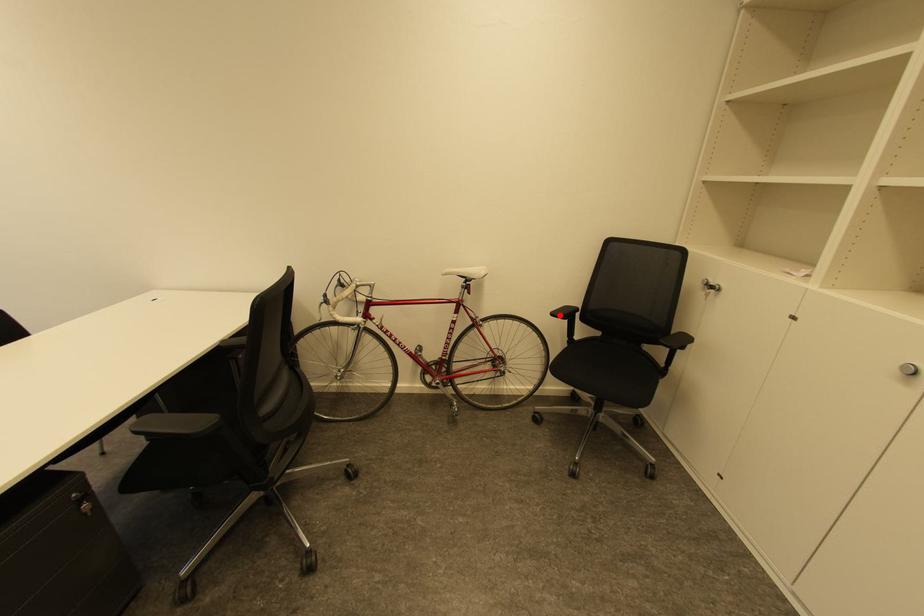
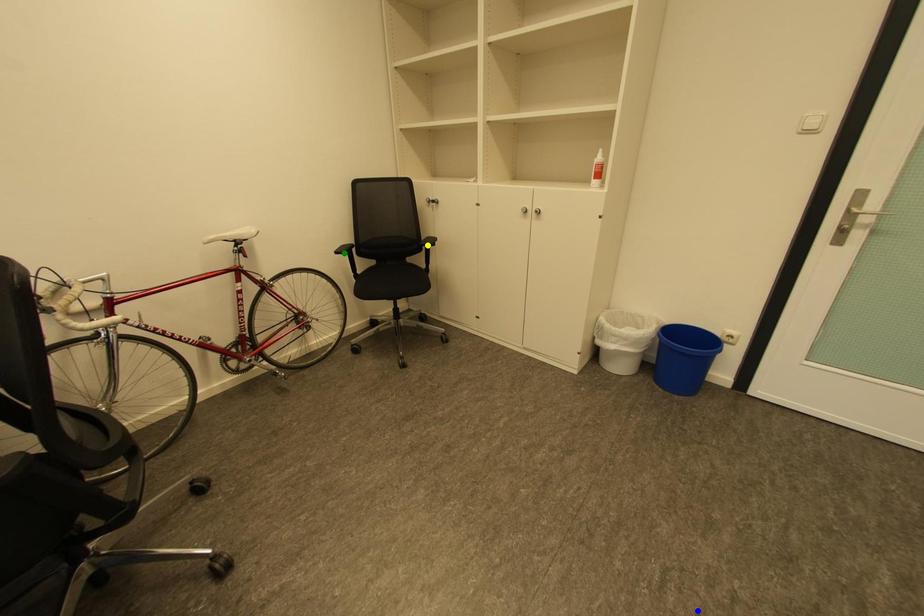
Question: I am providing you with two images of the same scene from different viewpoints. A red point is marked on the first image. You are given multiple points on the second image. Which point in image 2 is actually the same real-world point as the red point in image 1?

Choices:
 (A) yellow point
 (B) blue point
 (C) green point

Answer: (C)